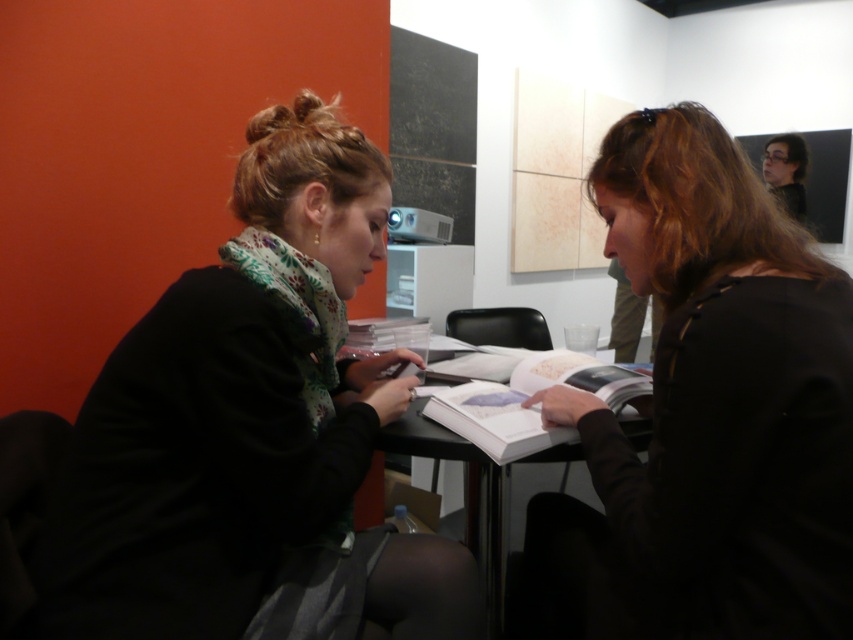
You are standing at the table and want to place the black matte jacket at center onto the black plastic table at center. Can you place it directly to the left of the table?

The black matte jacket at center is already to the right of the black plastic table at center. To place it to the left of the table, you would need to move it from its current position on the right to the left side of the table.

Where is the black matte jacket at center located in the image?

The black matte jacket at center is located at point 0.648 on the x axis and 0.829 on the y axis.

You are sitting at the table in the image and want to reach both the point at (540,524) and the point at (625,388). Which point will you reach first?

You will reach point (540,524) first because it is closer to you than point (625,388), which is further away.